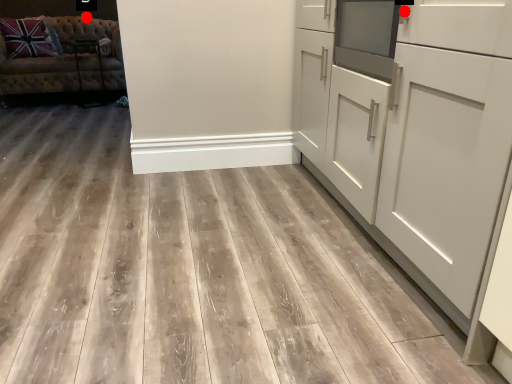
Question: Two points are circled on the image, labeled by A and B beside each circle. Among these points, which one is farthest from the camera?

Choices:
 (A) A is further
 (B) B is further

Answer: (B)